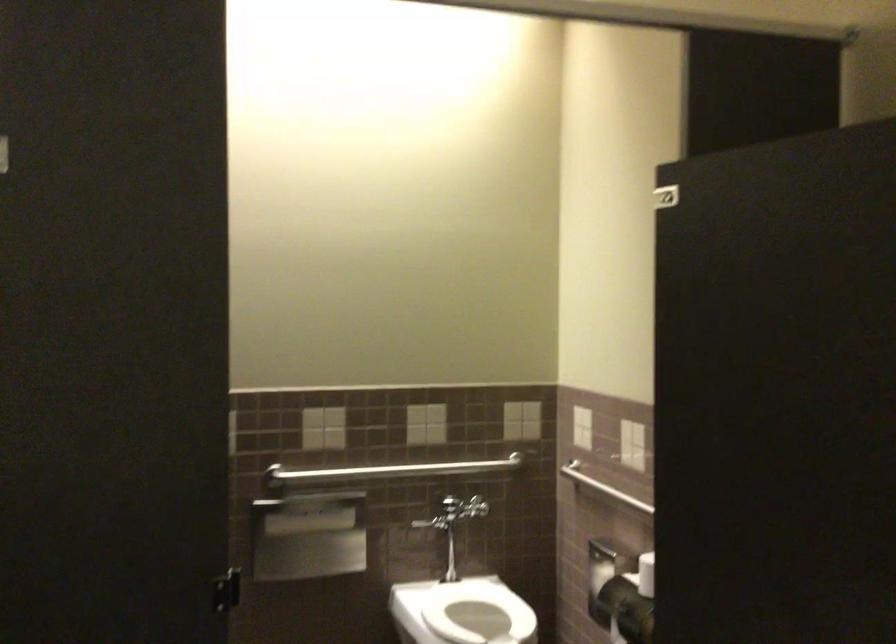
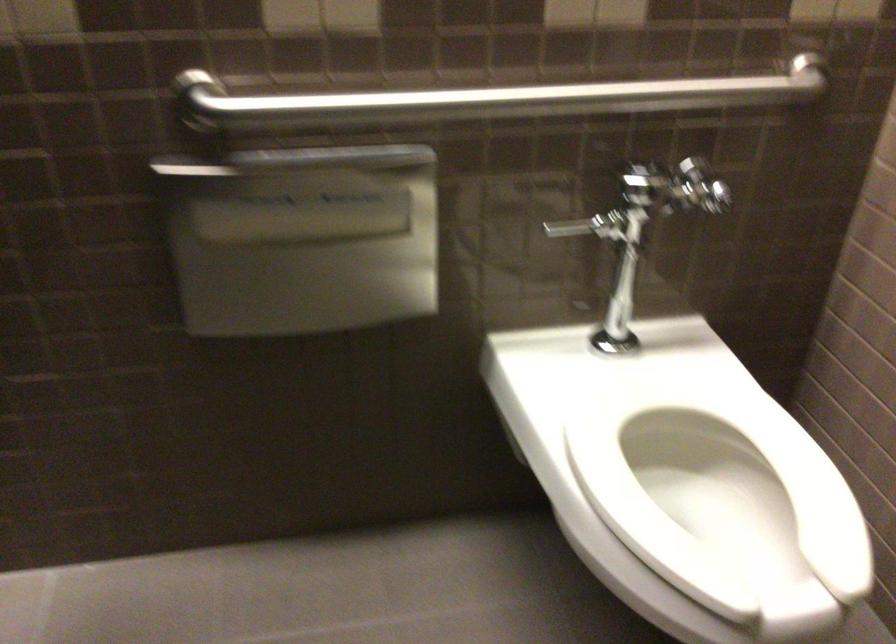
Where in the second image is the point corresponding to (431,525) from the first image?

(589, 225)